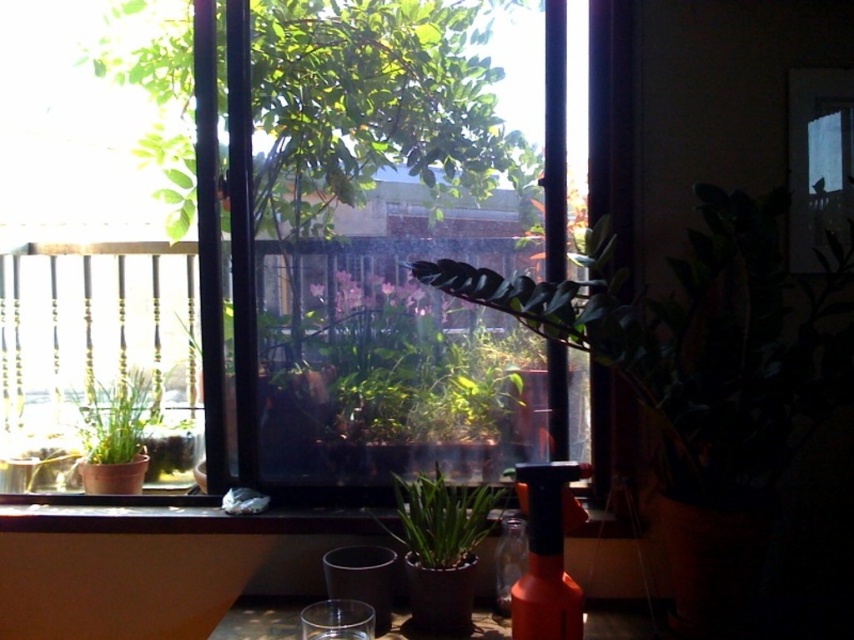
Can you confirm if transparent glass window at center is wider than translucent glass bottle at center?

Correct, the width of transparent glass window at center exceeds that of translucent glass bottle at center.

Consider the image. Does transparent glass window at center appear over translucent glass bottle at center?

Yes.

Who is more distant from viewer, (369, 440) or (524, 522)?

The point (369, 440) is behind.

Image resolution: width=854 pixels, height=640 pixels. Find the location of `transparent glass window at center`. transparent glass window at center is located at coordinates (340, 355).

Does green matte leafy plant at center have a greater width compared to orange matte spray bottle at lower right?

Yes.

At what (x,y) coordinates should I click in order to perform the action: click on green matte leafy plant at center. Please return your answer as a coordinate pair (x, y). Looking at the image, I should click on (702, 339).

Which is behind, point (601, 296) or point (542, 579)?

Positioned behind is point (601, 296).

Locate an element on the screen. This screenshot has height=640, width=854. green matte leafy plant at center is located at coordinates (702, 339).

Is orange matte spray bottle at lower right above green matte plant at center?

Incorrect, orange matte spray bottle at lower right is not positioned above green matte plant at center.

Can you confirm if orange matte spray bottle at lower right is positioned to the right of green matte plant at center?

Correct, you'll find orange matte spray bottle at lower right to the right of green matte plant at center.

What do you see at coordinates (545, 557) in the screenshot? This screenshot has height=640, width=854. I see `orange matte spray bottle at lower right` at bounding box center [545, 557].

Where is `orange matte spray bottle at lower right`? The image size is (854, 640). orange matte spray bottle at lower right is located at coordinates (545, 557).